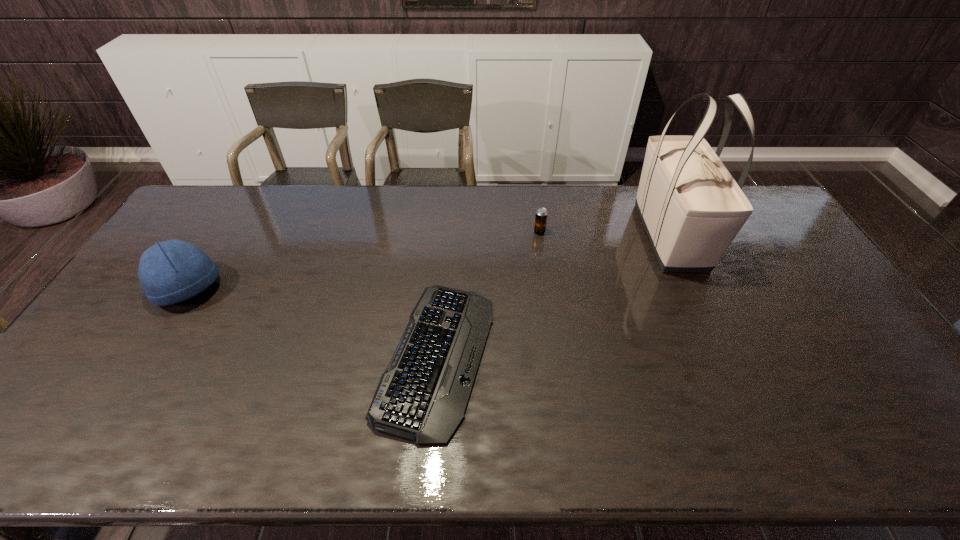
I want to click on vacant space located 0.110m on the front of the beer can, so click(x=543, y=258).

You are a GUI agent. You are given a task and a screenshot of the screen. Output one action in this format:
    pyautogui.click(x=<x>, y=<y>)
    Task: Click on the blank space located 0.250m on the left of the computer keyboard
    
    Given the screenshot: What is the action you would take?
    pyautogui.click(x=283, y=356)

Locate an element on the screen. The height and width of the screenshot is (540, 960). object at the far edge is located at coordinates (691, 207).

Locate an element on the screen. This screenshot has width=960, height=540. object that is positioned at the near edge is located at coordinates (422, 396).

At what (x,y) coordinates should I click in order to perform the action: click on object that is positioned at the left edge. Please return your answer as a coordinate pair (x, y). Looking at the image, I should click on (172, 271).

Where is `free region at the far edge of the desktop`? free region at the far edge of the desktop is located at coordinates (379, 201).

At what (x,y) coordinates should I click in order to perform the action: click on free spot at the near edge of the desktop. Please return your answer as a coordinate pair (x, y). The width and height of the screenshot is (960, 540). Looking at the image, I should click on (800, 437).

At what (x,y) coordinates should I click in order to perform the action: click on vacant space at the left edge. Please return your answer as a coordinate pair (x, y). This screenshot has width=960, height=540. Looking at the image, I should click on (73, 415).

Locate an element on the screen. free space at the right edge is located at coordinates click(x=798, y=282).

In the image, there is a desktop. Identify the location of vacant space at the far left corner. (189, 223).